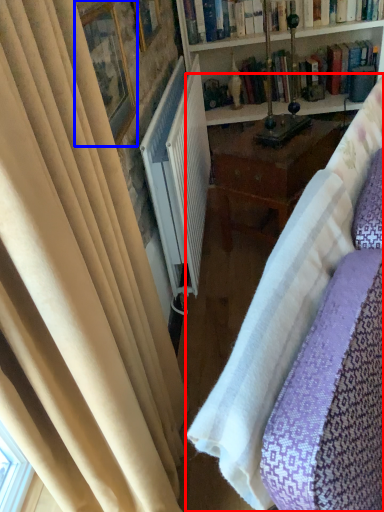
Question: Which object appears closest to the camera in this image, studio couch (highlighted by a red box) or picture frame (highlighted by a blue box)?

Choices:
 (A) studio couch
 (B) picture frame

Answer: (A)